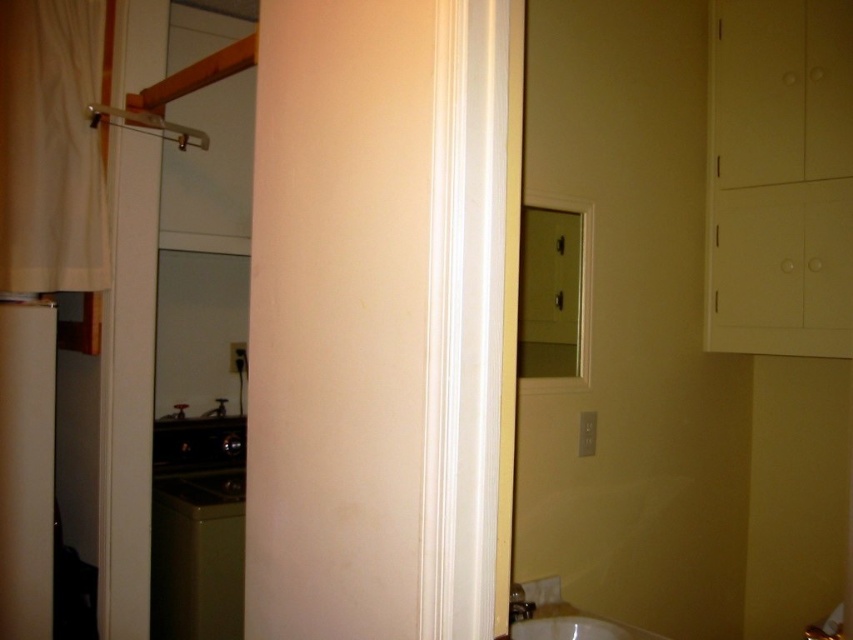
Question: Is white fabric curtain at left below white glossy sink at lower center?

Choices:
 (A) no
 (B) yes

Answer: (A)

Question: Which point is farther to the camera?

Choices:
 (A) (646, 632)
 (B) (20, 180)

Answer: (B)

Question: Which object is farther from the camera taking this photo?

Choices:
 (A) white fabric curtain at left
 (B) clear plastic shower at upper left

Answer: (B)

Question: Which of these objects is positioned closest to the white glossy sink at lower center?

Choices:
 (A) clear plastic shower at upper left
 (B) white fabric curtain at left

Answer: (B)

Question: Can you confirm if white fabric curtain at left is positioned below clear plastic shower at upper left?

Choices:
 (A) yes
 (B) no

Answer: (A)

Question: Is white fabric curtain at left smaller than clear plastic shower at upper left?

Choices:
 (A) yes
 (B) no

Answer: (B)